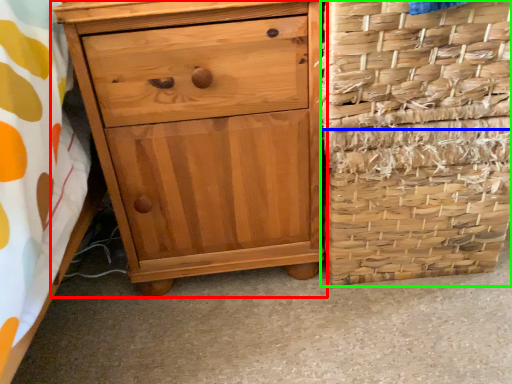
Question: Considering the real-world distances, which object is closest to chest of drawers (highlighted by a red box)? basket (highlighted by a blue box) or basket container (highlighted by a green box).

Choices:
 (A) basket
 (B) basket container

Answer: (B)